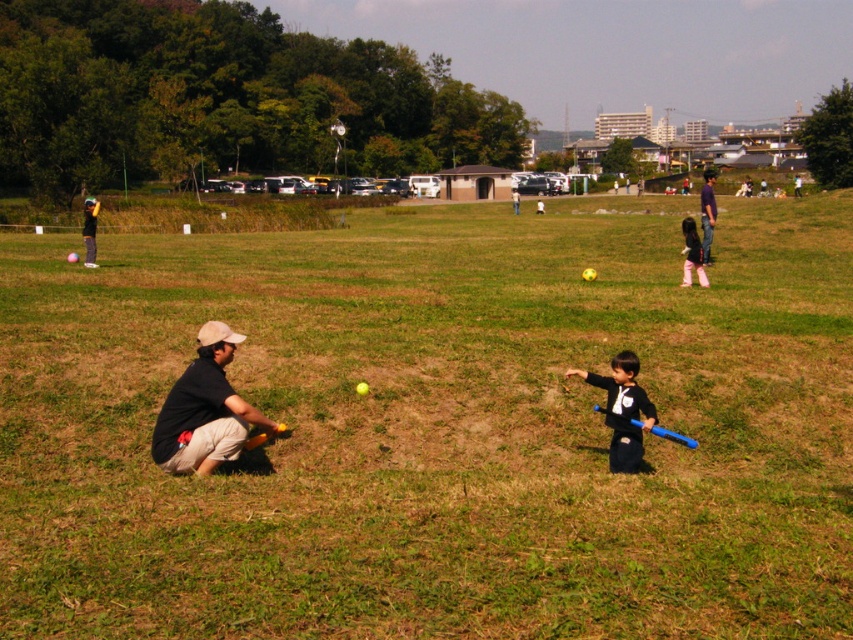
Which is more to the right, black fabric pants at right or blue plastic bat at lower center?

Positioned to the right is black fabric pants at right.

Does black fabric pants at right have a lesser width compared to blue plastic bat at lower center?

Incorrect, black fabric pants at right's width is not less than blue plastic bat at lower center's.

Does point (682, 250) come behind point (635, 424)?

That is True.

Where is `black fabric pants at right`? black fabric pants at right is located at coordinates (x=692, y=253).

Who is higher up, black fabric pants at right or yellow matte baseball bat at lower center?

black fabric pants at right is higher up.

Can you confirm if black fabric pants at right is positioned to the right of yellow matte baseball bat at lower center?

Indeed, black fabric pants at right is positioned on the right side of yellow matte baseball bat at lower center.

Does point (695, 240) come closer to viewer compared to point (260, 442)?

No, it is not.

Locate an element on the screen. This screenshot has height=640, width=853. black fabric pants at right is located at coordinates (692, 253).

Does black matte baseball bat at lower center have a larger size compared to blue plastic bat at lower center?

Correct, black matte baseball bat at lower center is larger in size than blue plastic bat at lower center.

Which of these two, black matte baseball bat at lower center or blue plastic bat at lower center, stands taller?

With more height is black matte baseball bat at lower center.

This screenshot has height=640, width=853. What do you see at coordinates (622, 410) in the screenshot? I see `black matte baseball bat at lower center` at bounding box center [622, 410].

Where is `black matte baseball bat at lower center`? Image resolution: width=853 pixels, height=640 pixels. black matte baseball bat at lower center is located at coordinates (622, 410).